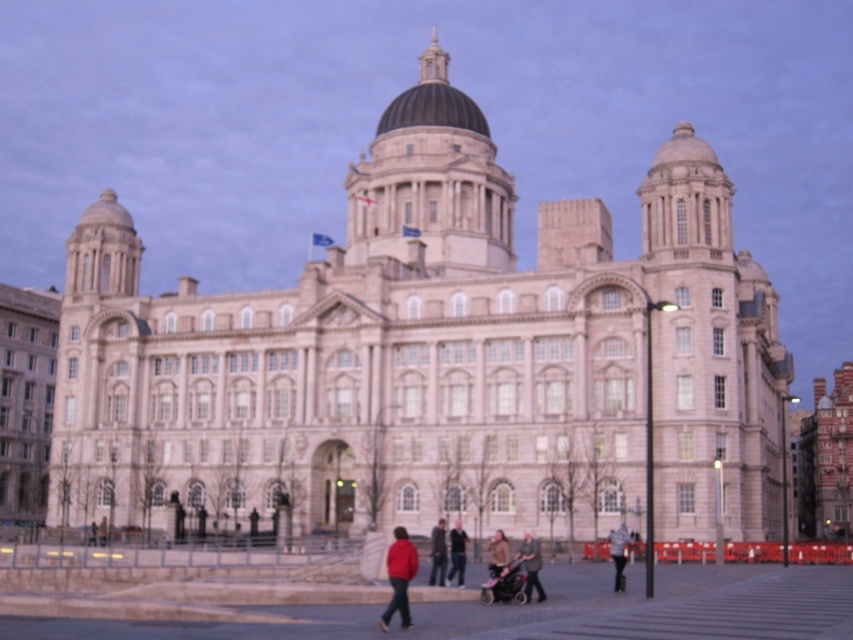
Question: Does matte red jacket at lower center have a larger size compared to red jacket at center?

Choices:
 (A) no
 (B) yes

Answer: (B)

Question: Which point is closer to the camera?

Choices:
 (A) matte red jacket at center
 (B) brown leather jacket at center
 (C) matte red jacket at lower center
 (D) red jacket at center

Answer: (C)

Question: Which object is closer to the camera taking this photo?

Choices:
 (A) white stone building at center
 (B) red jacket at center
 (C) matte red jacket at lower center
 (D) brown leather jacket at center

Answer: (C)

Question: Can you confirm if pink fabric stroller at lower center is smaller than dark gray fabric jacket at center?

Choices:
 (A) yes
 (B) no

Answer: (A)

Question: In this image, where is pink fabric stroller at lower center located relative to red jacket at center?

Choices:
 (A) above
 (B) below

Answer: (A)

Question: Which point is farther to the camera?

Choices:
 (A) matte red jacket at center
 (B) dark gray fabric jacket at center

Answer: (A)